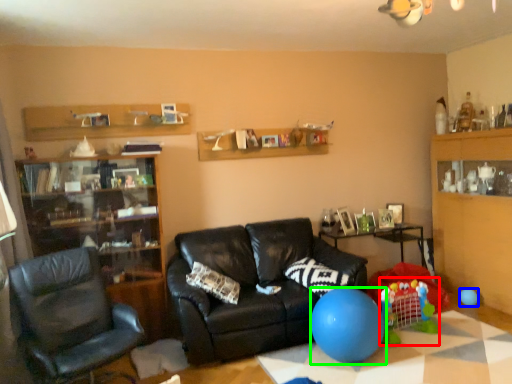
Question: Which is nearer to the toy (highlighted by a red box)? balloon (highlighted by a blue box) or balloon (highlighted by a green box).

Choices:
 (A) balloon
 (B) balloon

Answer: (B)